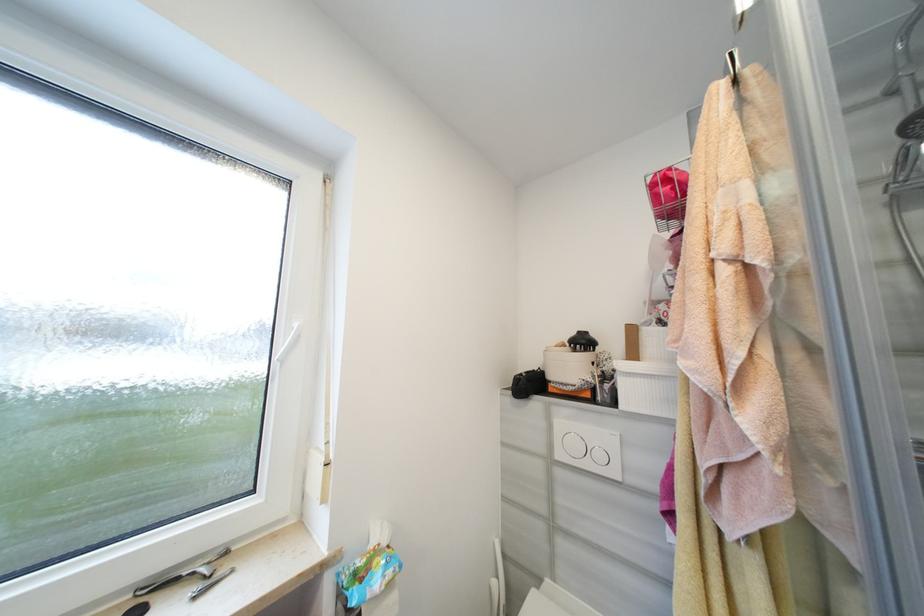
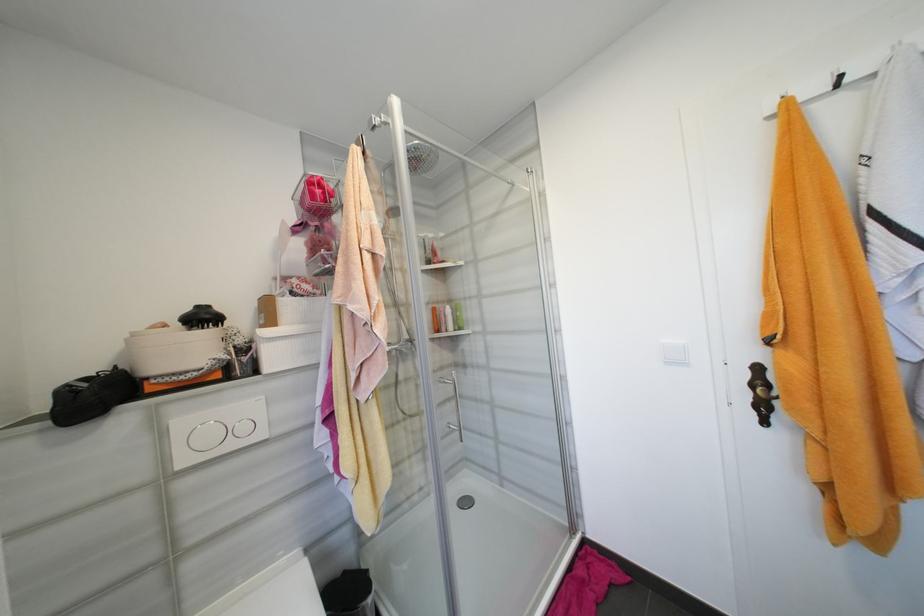
The point at (565, 456) is marked in the first image. Where is the corresponding point in the second image?

(189, 463)